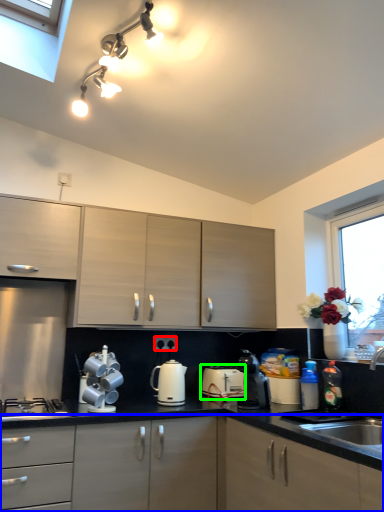
Question: Which object is positioned farthest from electric outlet (highlighted by a red box)? Select from cabinetry (highlighted by a blue box) and appliance (highlighted by a green box).

Choices:
 (A) cabinetry
 (B) appliance

Answer: (A)